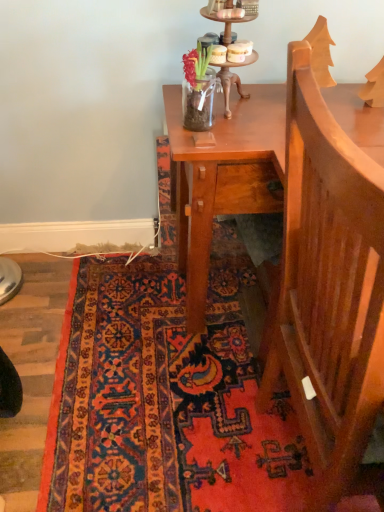
Question: Is wooden armchair at right wider or thinner than carpet with intricate patterns at lower center?

Choices:
 (A) thin
 (B) wide

Answer: (A)

Question: Relative to carpet with intricate patterns at lower center, is wooden armchair at right in front or behind?

Choices:
 (A) behind
 (B) front

Answer: (B)

Question: Which is nearer to the wooden armchair at right?

Choices:
 (A) carpet with intricate patterns at lower center
 (B) wooden candle holder at upper center

Answer: (A)

Question: Estimate the real-world distances between objects in this image. Which object is farther from the carpet with intricate patterns at lower center?

Choices:
 (A) wooden candle holder at upper center
 (B) wooden armchair at right

Answer: (A)